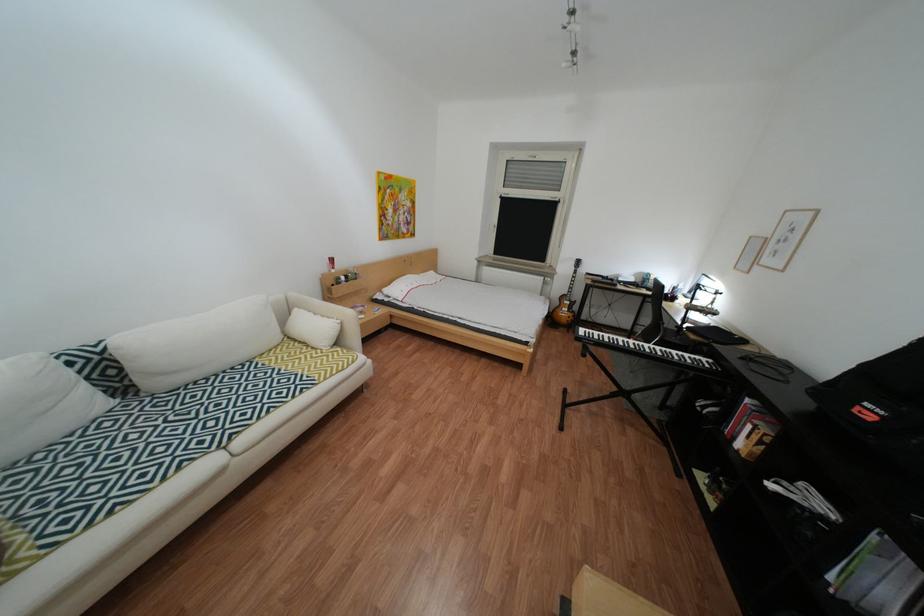
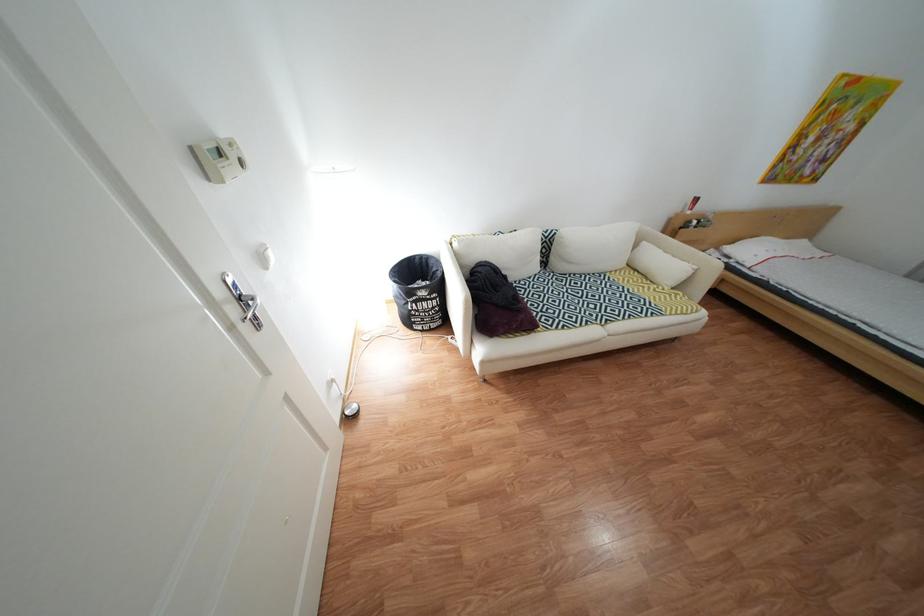
In the second image, find the point that corresponds to the point at 311,342 in the first image.

(651, 272)